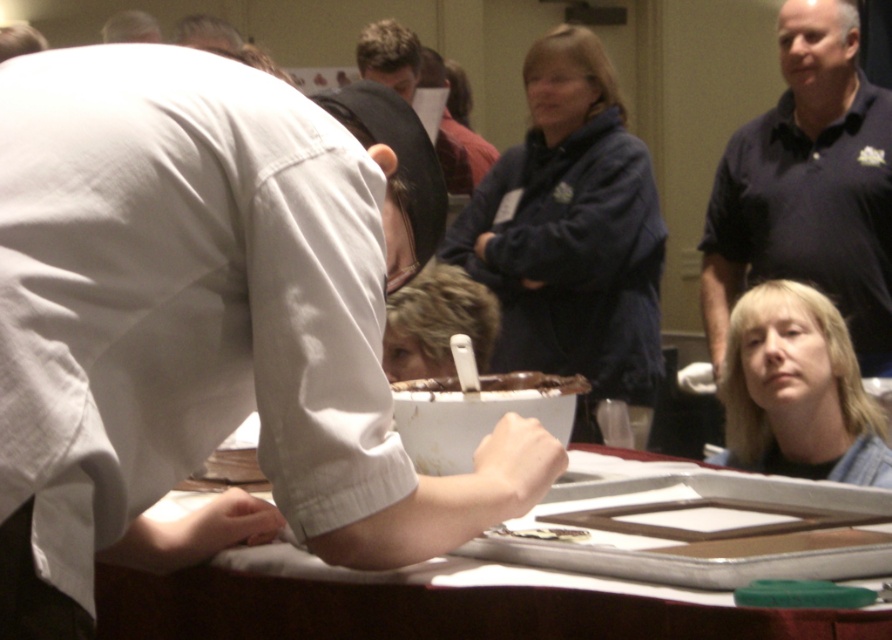
You are standing at the point marked by the coordinates point (211, 323). Looking around, you see the white fabric shirt at center. Can you determine if the white fabric shirt at center is in front of or behind the person in the dark blue jacket?

The white fabric shirt at center is represented by point (211, 323), which is the same as your current position. Therefore, you are standing at the location of the white fabric shirt at center, so you cannot see if it is in front of or behind the person in the dark blue jacket because you are at that point.

Consider the image. You are a photographer trying to capture the perfect shot of the event. You want to position yourself at point A, which is 0.5 units to the right and 0.2 units above the white fabric shirt at center. Is this position within the frame of the image?

The white fabric shirt at center is located at point (211,323). Position A is at (389,323). Since the image frame typically spans from 0 to 1 on both axes, this position is within the frame as both coordinates are between 0 and 1.